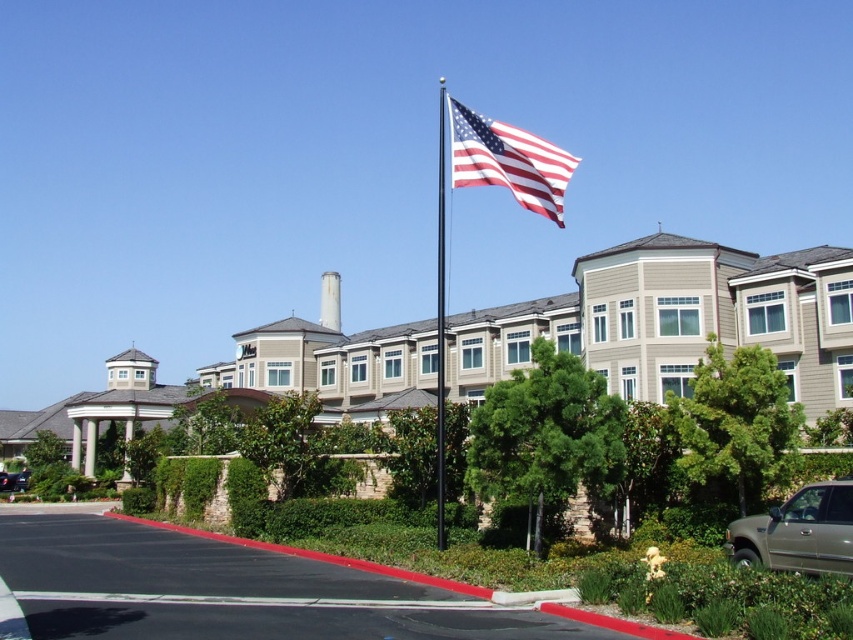
Is gold metallic truck at lower right positioned behind black metallic flag pole at center?

No, it is in front of black metallic flag pole at center.

Who is taller, gold metallic truck at lower right or black metallic flag pole at center?

A: With more height is black metallic flag pole at center.

Between point (802, 502) and point (444, 401), which one is positioned behind?

Point (444, 401)

In order to click on gold metallic truck at lower right in this screenshot , I will do `click(798, 532)`.

Is gold metallic truck at lower right below american flag at upper center?

Yes, gold metallic truck at lower right is below american flag at upper center.

Who is more distant from viewer, (793, 541) or (498, 179)?

The point (498, 179) is behind.

Which is behind, point (751, 564) or point (525, 182)?

The point (525, 182) is behind.

Image resolution: width=853 pixels, height=640 pixels. In order to click on gold metallic truck at lower right in this screenshot , I will do `click(798, 532)`.

Can you confirm if american flag at upper center is taller than shiny black sedan at lower left?

Yes, american flag at upper center is taller than shiny black sedan at lower left.

Where is `american flag at upper center`? This screenshot has height=640, width=853. american flag at upper center is located at coordinates (508, 161).